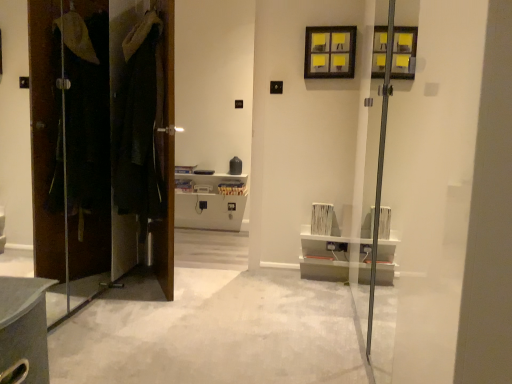
Question: Considering the positions of yellow paper at upper center and dark brown leather coat at left, the first door in the right-to-left sequence, in the image, is yellow paper at upper center wider or thinner than dark brown leather coat at left, the first door in the right-to-left sequence,?

Choices:
 (A) thin
 (B) wide

Answer: (A)

Question: Is yellow paper at upper center taller or shorter than dark brown leather coat at left, the first door in the right-to-left sequence?

Choices:
 (A) tall
 (B) short

Answer: (B)

Question: Considering the real-world distances, which object is farthest from the white carpet at center?

Choices:
 (A) brown wood door at left, the 2th door positioned from the right
 (B) yellow paper at upper center
 (C) dark brown leather coat at left, the first door in the right-to-left sequence

Answer: (B)

Question: Which object is positioned closest to the yellow paper at upper center?

Choices:
 (A) brown wood door at left, the 2th door positioned from the right
 (B) white carpet at center
 (C) dark brown leather coat at left, which appears as the second door when viewed from the left

Answer: (C)